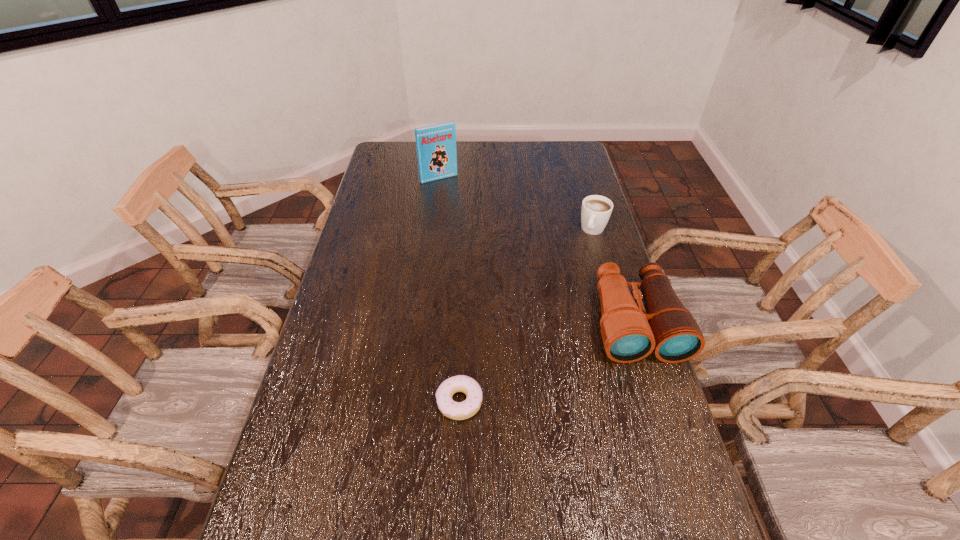
What are the coordinates of `free area in between the nearest object and the second farthest object` in the screenshot? It's located at (526, 316).

Identify the location of free space between the shortest object and the tallest object. The image size is (960, 540). (449, 290).

In order to click on unoccupied position between the doughnut and the book in this screenshot , I will do `click(449, 290)`.

The image size is (960, 540). In order to click on unoccupied position between the third farthest object and the book in this screenshot , I will do `click(537, 250)`.

Where is `the second closest object to the tallest object`? This screenshot has height=540, width=960. the second closest object to the tallest object is located at coordinates (629, 334).

Image resolution: width=960 pixels, height=540 pixels. In order to click on object that is the second closest to the shortest object in this screenshot , I will do `click(596, 210)`.

Find the location of a particular element. vacant area that satisfies the following two spatial constraints: 1. on the front side of the book; 2. on the left side of the shortest object is located at coordinates (412, 402).